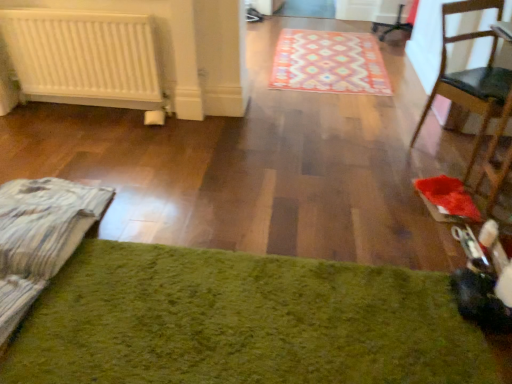
At what (x,y) coordinates should I click in order to perform the action: click on vacant space in front of white matte radiator at left. Please return your answer as a coordinate pair (x, y). The width and height of the screenshot is (512, 384). Looking at the image, I should click on (93, 138).